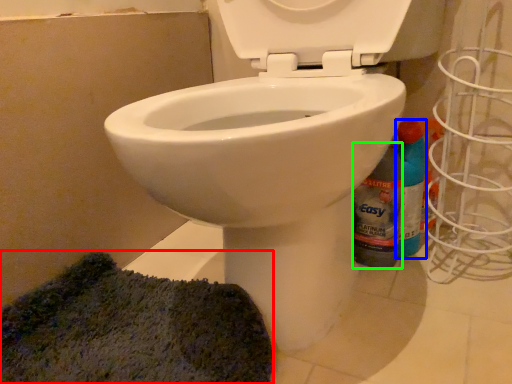
Question: Which object is the farthest from doormat (highlighted by a red box)? Choose among these: cleaning product (highlighted by a blue box) or bottle (highlighted by a green box).

Choices:
 (A) cleaning product
 (B) bottle

Answer: (A)